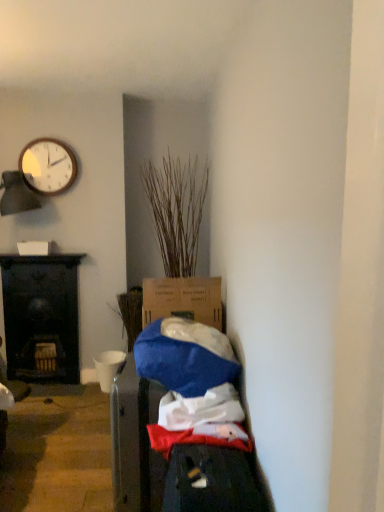
Question: Would you say matte white clock at upper left is to the left or to the right of black wood desk at left in the picture?

Choices:
 (A) left
 (B) right

Answer: (B)

Question: Looking at the image, does matte white clock at upper left seem bigger or smaller compared to black wood desk at left?

Choices:
 (A) big
 (B) small

Answer: (B)

Question: Which object is the farthest from the dry grass at center?

Choices:
 (A) black wood desk at left
 (B) matte white clock at upper left

Answer: (A)

Question: Estimate the real-world distances between objects in this image. Which object is closer to the matte white clock at upper left?

Choices:
 (A) black wood desk at left
 (B) dry grass at center

Answer: (B)